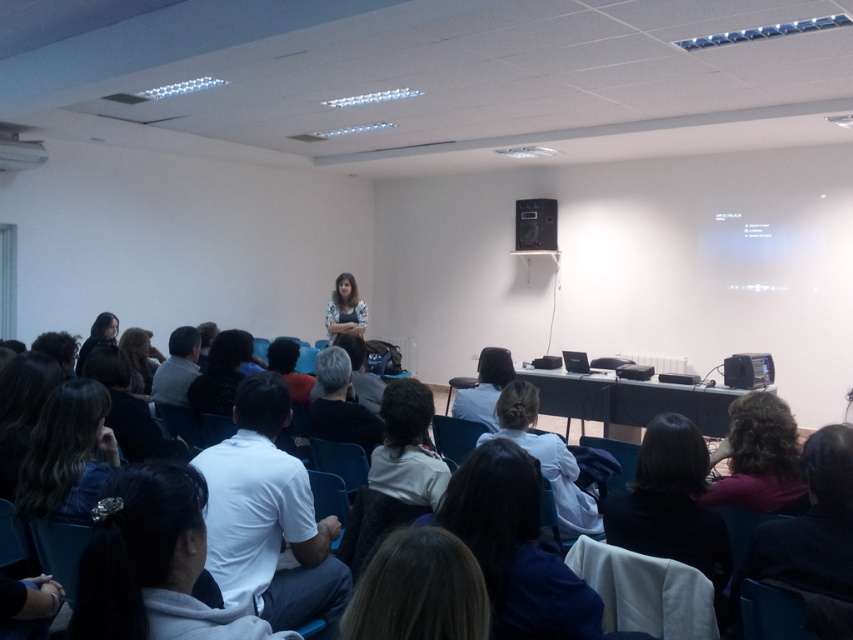
You are a photographer in the conference room. You need to take a photo of both dark brown hair at lower right and dark brown hair at lower left. Which one should you focus on first if you want to ensure both are in focus?

The dark brown hair at lower right is thinner than dark brown hair at lower left, so you should focus on the thicker dark brown hair at lower left first to ensure depth of field covers both.

Based on the photo, you are an event organizer checking the conference room setup. You see the white cotton shirt at center and the black plastic speaker at upper center. Which object is positioned more to the left side of the room?

The white cotton shirt at center is positioned to the left of the black plastic speaker at upper center, so it is more to the left side of the room.

You are an event organizer who needs to adjust the seating arrangement. You see the gray fabric shirt at center and the matte black jacket at left in the conference room. Which person should you approach first if you want to move someone closer to the front row?

The gray fabric shirt at center is below matte black jacket at left, meaning the person in the gray fabric shirt at center is seated closer to the front row. Approach the matte black jacket at left first to move them forward since they are further back.